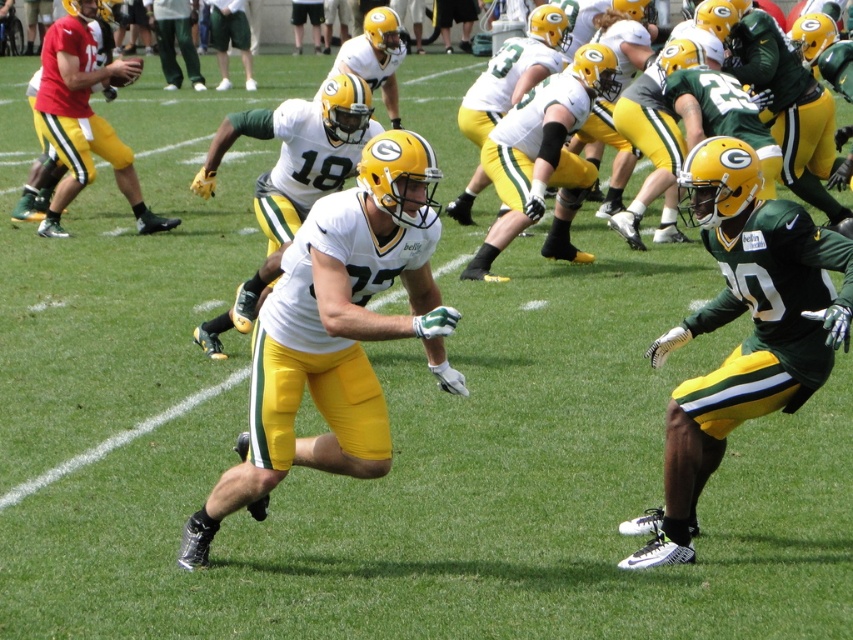
Question: Which of the following is the farthest from the observer?

Choices:
 (A) white matte jersey at center
 (B) green matte jersey at center
 (C) matte white jersey at center

Answer: (A)

Question: Does matte yellow uniform at left come behind green/yellow uniform at center?

Choices:
 (A) yes
 (B) no

Answer: (B)

Question: Estimate the real-world distances between objects in this image. Which object is farther from the green/yellow uniform at center?

Choices:
 (A) green matte jersey at center
 (B) matte white jersey at center
 (C) white matte jersey at center

Answer: (A)

Question: Can you confirm if white matte jersey at center is smaller than green/yellow uniform at center?

Choices:
 (A) no
 (B) yes

Answer: (A)

Question: Which is farther from the green/yellow uniform at center?

Choices:
 (A) white matte jersey at center
 (B) green matte jersey at center
 (C) matte white jersey at center
 (D) matte yellow uniform at left

Answer: (B)

Question: Is matte white jersey at center below green/yellow uniform at center?

Choices:
 (A) no
 (B) yes

Answer: (B)